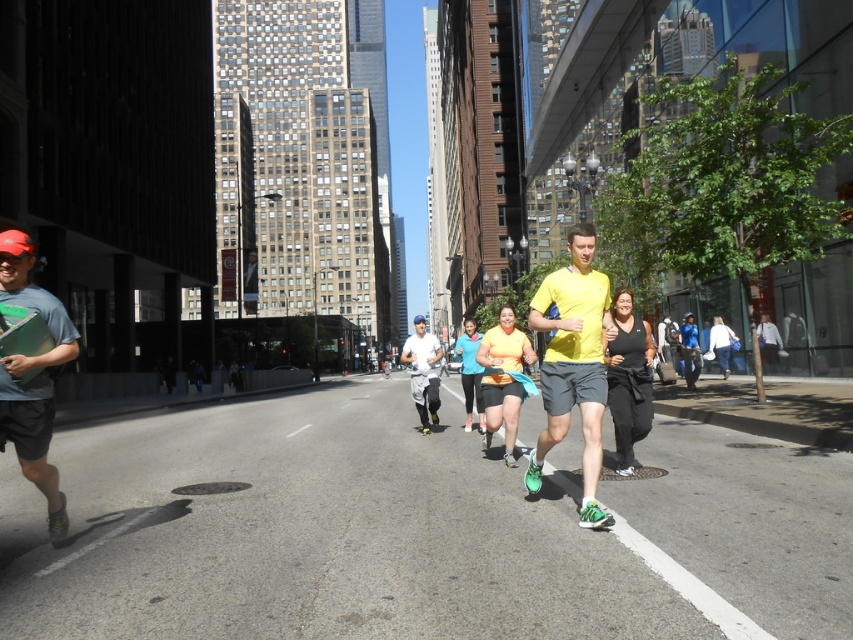
Question: Does matte gray shirt at left appear under white matte running shoes at center?

Choices:
 (A) yes
 (B) no

Answer: (B)

Question: Which object is closer to the camera taking this photo?

Choices:
 (A) white matte running shoes at center
 (B) yellow matte shirt at center
 (C) matte gray shirt at left

Answer: (C)

Question: Among these points, which one is farthest from the camera?

Choices:
 (A) coord(544,355)
 (B) coord(53,355)

Answer: (A)

Question: Which point is farther from the camera taking this photo?

Choices:
 (A) (585, 260)
 (B) (20, 248)

Answer: (A)

Question: Is matte gray shirt at left above white matte running shoes at center?

Choices:
 (A) no
 (B) yes

Answer: (B)

Question: Can you confirm if matte gray shirt at left is positioned to the left of white matte running shoes at center?

Choices:
 (A) yes
 (B) no

Answer: (A)